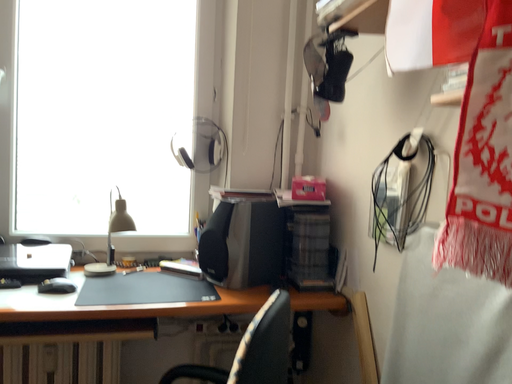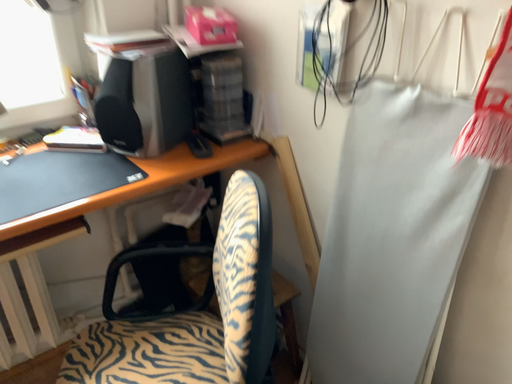
Question: Which way did the camera rotate in the video?

Choices:
 (A) rotated right
 (B) rotated left

Answer: (A)